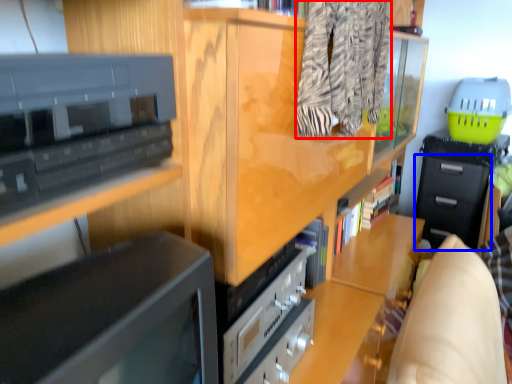
Question: Which object is closer to the camera taking this photo, clothing (highlighted by a red box) or drawer (highlighted by a blue box)?

Choices:
 (A) clothing
 (B) drawer

Answer: (A)